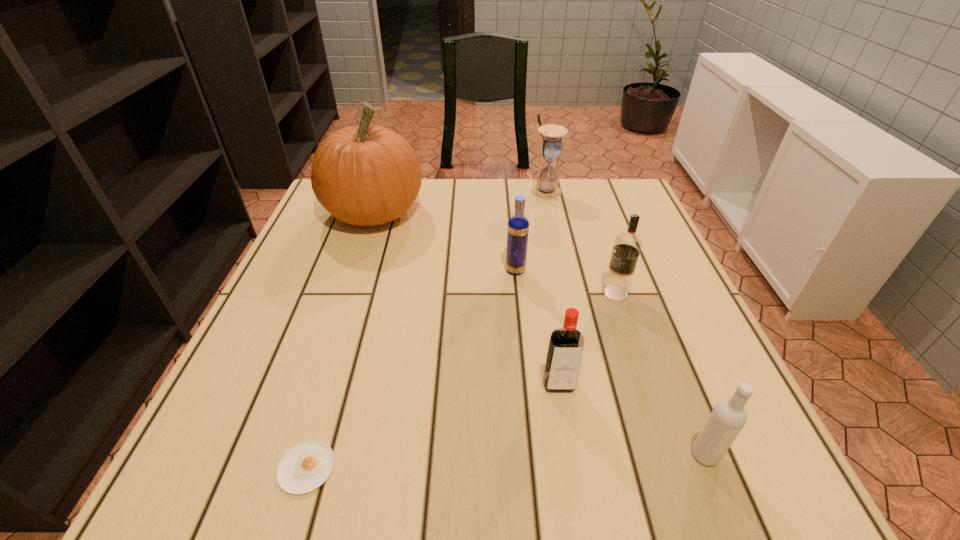
Locate an element on the screen. This screenshot has width=960, height=540. pumpkin that is at the far edge is located at coordinates coord(367,175).

Locate an element on the screen. hourglass positioned at the far edge is located at coordinates (551, 145).

Image resolution: width=960 pixels, height=540 pixels. In order to click on vodka that is at the near edge in this screenshot , I will do pyautogui.click(x=727, y=419).

You are a GUI agent. You are given a task and a screenshot of the screen. Output one action in this format:
    pyautogui.click(x=<x>, y=<y>)
    Task: Click on the egg yolk positioned at the near edge
    The height and width of the screenshot is (540, 960).
    Given the screenshot: What is the action you would take?
    pyautogui.click(x=306, y=466)

Identify the location of pumpkin located at the left edge. This screenshot has height=540, width=960. (367, 175).

I want to click on egg yolk that is positioned at the left edge, so (x=306, y=466).

At what (x,y) coordinates should I click in order to perform the action: click on object that is at the far left corner. Please return your answer as a coordinate pair (x, y). The height and width of the screenshot is (540, 960). Looking at the image, I should click on (367, 175).

At what (x,y) coordinates should I click in order to perform the action: click on object that is at the near left corner. Please return your answer as a coordinate pair (x, y). Looking at the image, I should click on (306, 466).

This screenshot has width=960, height=540. I want to click on object situated at the near right corner, so click(727, 419).

You are a GUI agent. You are given a task and a screenshot of the screen. Output one action in this format:
    pyautogui.click(x=<x>, y=<y>)
    Task: Click on the free space at the far edge of the desktop
    The image size is (960, 540).
    Given the screenshot: What is the action you would take?
    pyautogui.click(x=504, y=195)